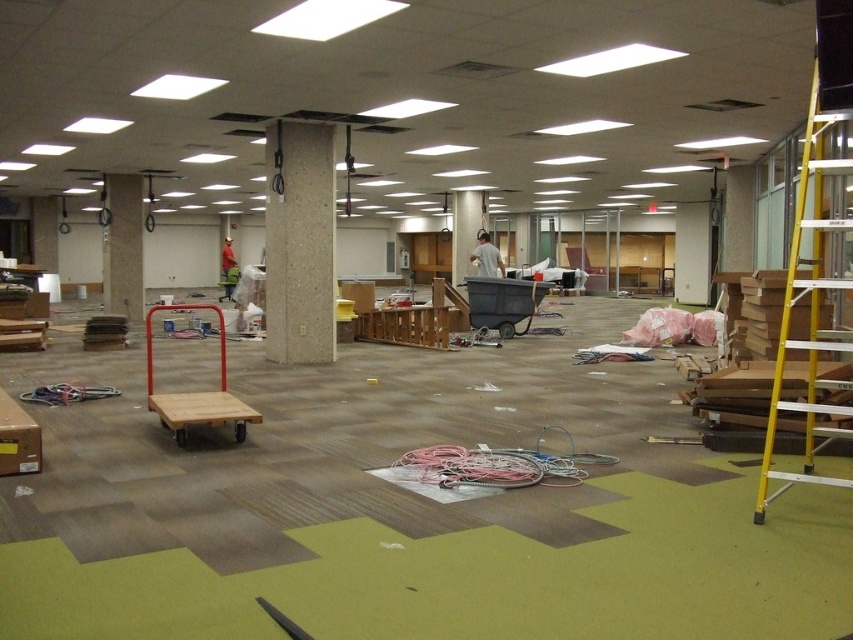
Who is higher up, yellow metallic ladder at right or white fabric shirt at center?

white fabric shirt at center is higher up.

How much distance is there between yellow metallic ladder at right and white fabric shirt at center?

They are 9.38 meters apart.

Which is in front, point (804, 140) or point (482, 248)?

Positioned in front is point (804, 140).

Locate an element on the screen. The width and height of the screenshot is (853, 640). yellow metallic ladder at right is located at coordinates (811, 305).

Consider the image. Can you confirm if yellow metallic ladder at right is positioned below wooden cart at center?

Yes.

Does yellow metallic ladder at right have a lesser width compared to wooden cart at center?

Yes, yellow metallic ladder at right is thinner than wooden cart at center.

Does point (810, 422) come behind point (152, 368)?

No, (810, 422) is in front of (152, 368).

Identify the location of yellow metallic ladder at right. (811, 305).

Is white glossy pillar at center below white fabric shirt at center?

No.

The image size is (853, 640). What do you see at coordinates (465, 230) in the screenshot?
I see `white glossy pillar at center` at bounding box center [465, 230].

The height and width of the screenshot is (640, 853). In order to click on white glossy pillar at center in this screenshot , I will do `click(465, 230)`.

Image resolution: width=853 pixels, height=640 pixels. In order to click on white glossy pillar at center in this screenshot , I will do `click(465, 230)`.